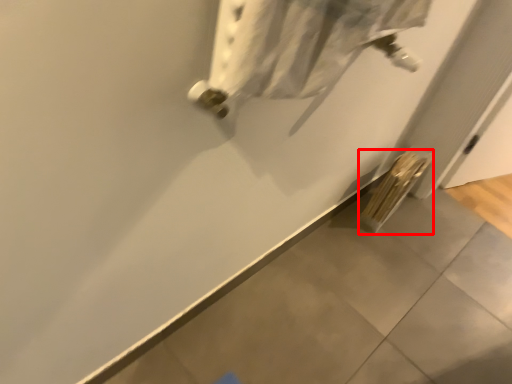
Question: Considering the relative positions of radiator (annotated by the red box) and wide in the image provided, where is radiator (annotated by the red box) located with respect to the staircase?

Choices:
 (A) left
 (B) right

Answer: (B)